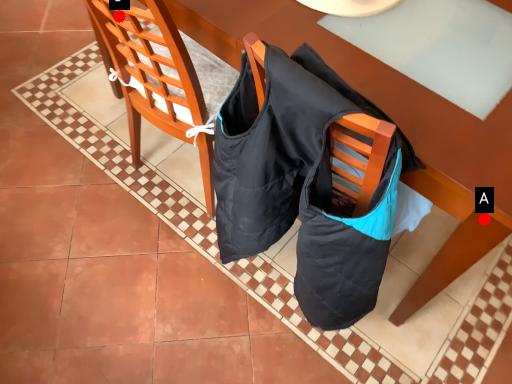
Question: Two points are circled on the image, labeled by A and B beside each circle. Among these points, which one is farthest from the camera?

Choices:
 (A) A is further
 (B) B is further

Answer: (B)